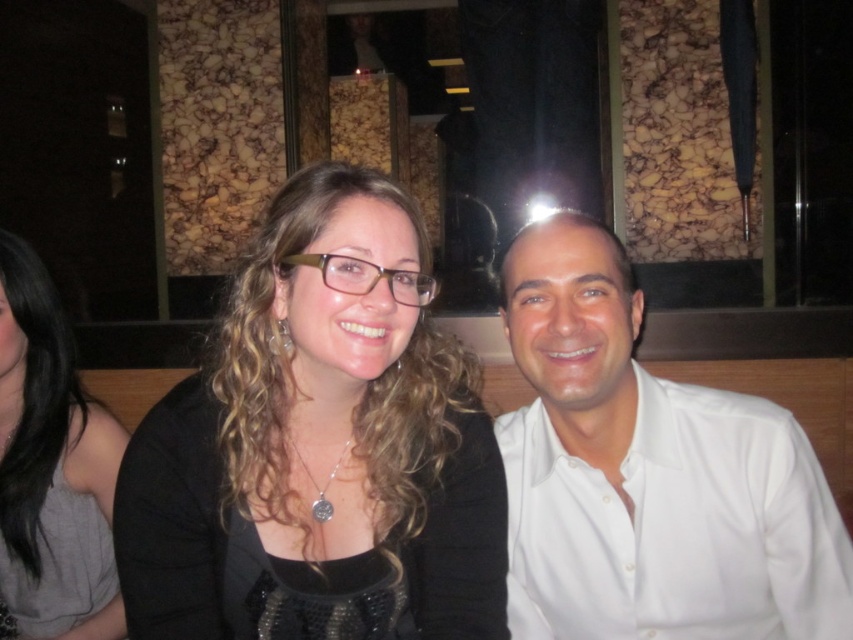
You are a photographer standing 1 meter away from the camera. You want to adjust your position so that you are exactly 1 meter away from the black matte hair at center. Should you move closer or farther away from the camera?

The black matte hair at center is currently 84.42 centimeters away from the camera. Since you are standing 1 meter away from the camera, you are already farther than the desired distance. To be exactly 1 meter away from the black matte hair at center, you should move closer to the camera by approximately 15.58 centimeters.

You are taking a photo of two people sitting in a booth. You want to focus on the person closer to the camera. Which point should you focus on, point (456, 627) or point (39, 400)?

Point (456, 627) is closer to the camera than point (39, 400), so you should focus on point (456, 627) to capture the person closer to the camera.